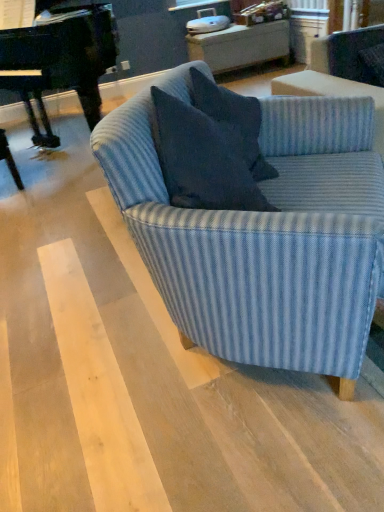
You are a GUI agent. You are given a task and a screenshot of the screen. Output one action in this format:
    pyautogui.click(x=<x>, y=<y>)
    Task: Click on the dark blue fabric pillow at center
    Image resolution: width=384 pixels, height=512 pixels.
    Given the screenshot: What is the action you would take?
    pyautogui.click(x=234, y=121)

What is the approximate height of black polished piano at left?

black polished piano at left is 3.76 feet in height.

Locate an element on the screen. Image resolution: width=384 pixels, height=512 pixels. blue striped fabric couch at center is located at coordinates (265, 237).

Does blue striped fabric swivel chair at upper right have a greater width compared to dark blue fabric pillow at center?

In fact, blue striped fabric swivel chair at upper right might be narrower than dark blue fabric pillow at center.

Between blue striped fabric swivel chair at upper right and dark blue fabric pillow at center, which one has larger size?

dark blue fabric pillow at center.

This screenshot has height=512, width=384. In the image, there is a dark blue fabric pillow at center. What are the coordinates of `swivel chair above it (from the image's perspective)` in the screenshot? It's located at (351, 55).

From the image's perspective, is dark blue fabric pillow at center located beneath blue striped fabric couch at center?

No.

Is dark blue fabric pillow at center oriented towards blue striped fabric couch at center?

Yes, dark blue fabric pillow at center faces towards blue striped fabric couch at center.

Measure the distance from dark blue fabric pillow at center to blue striped fabric couch at center.

They are 11.68 inches apart.

Is dark blue fabric pillow at center surrounding blue striped fabric couch at center?

No, blue striped fabric couch at center is located outside of dark blue fabric pillow at center.

Find the location of a particular element. This screenshot has height=512, width=384. pillow located above the black polished piano at left (from a real-world perspective) is located at coordinates (234, 121).

Considering the points (102, 29) and (242, 129), which point is behind, point (102, 29) or point (242, 129)?

The point (102, 29) is farther from the camera.

From the image's perspective, is black polished piano at left located above or below dark blue fabric pillow at center?

black polished piano at left is above dark blue fabric pillow at center.

Does dark blue fabric pillow at center have a greater height compared to black polished piano at left?

In fact, dark blue fabric pillow at center may be shorter than black polished piano at left.

Does dark blue fabric pillow at center have a greater width compared to black polished piano at left?

In fact, dark blue fabric pillow at center might be narrower than black polished piano at left.

From the image's perspective, is dark blue fabric pillow at center above black polished piano at left?

No.

Based on their sizes in the image, would you say dark blue fabric pillow at center is bigger or smaller than black polished piano at left?

Clearly, dark blue fabric pillow at center is smaller in size than black polished piano at left.

Is dark blue fabric pillow at center far from blue striped fabric swivel chair at upper right?

Indeed, dark blue fabric pillow at center is not near blue striped fabric swivel chair at upper right.

Does dark blue fabric pillow at center appear on the right side of blue striped fabric swivel chair at upper right?

No, dark blue fabric pillow at center is not to the right of blue striped fabric swivel chair at upper right.

From a real-world perspective, is dark blue fabric pillow at center physically above blue striped fabric swivel chair at upper right?

Yes, from a real-world perspective, dark blue fabric pillow at center is above blue striped fabric swivel chair at upper right.

Does point (243, 150) come behind point (313, 61)?

No, (243, 150) is in front of (313, 61).

From the image's perspective, which one is positioned higher, blue striped fabric swivel chair at upper right or blue striped fabric couch at center?

blue striped fabric swivel chair at upper right, from the image's perspective.

Would you say blue striped fabric couch at center is part of blue striped fabric swivel chair at upper right's contents?

No, blue striped fabric swivel chair at upper right does not contain blue striped fabric couch at center.

Between blue striped fabric couch at center and blue striped fabric swivel chair at upper right, which one has less height?

With less height is blue striped fabric swivel chair at upper right.

Considering the sizes of objects blue striped fabric couch at center and blue striped fabric swivel chair at upper right in the image provided, who is bigger, blue striped fabric couch at center or blue striped fabric swivel chair at upper right?

Bigger between the two is blue striped fabric couch at center.

Which of these two, blue striped fabric couch at center or blue striped fabric swivel chair at upper right, is thinner?

With smaller width is blue striped fabric swivel chair at upper right.

How many degrees apart are the facing directions of blue striped fabric couch at center and blue striped fabric swivel chair at upper right?

The facing directions of blue striped fabric couch at center and blue striped fabric swivel chair at upper right are 51.2 degrees apart.

I want to click on swivel chair above the dark blue fabric pillow at center (from the image's perspective), so click(x=351, y=55).

I want to click on pillow on the left of blue striped fabric couch at center, so click(x=234, y=121).

Considering their positions, is blue striped fabric swivel chair at upper right positioned closer to blue striped fabric couch at center than dark blue fabric pillow at center?

dark blue fabric pillow at center lies closer to blue striped fabric couch at center than the other object.

When comparing their distances from black polished piano at left, does dark blue fabric pillow at center or blue striped fabric couch at center seem further?

blue striped fabric couch at center is further to black polished piano at left.

Considering their positions, is dark blue fabric pillow at center positioned closer to blue striped fabric couch at center than blue striped fabric swivel chair at upper right?

dark blue fabric pillow at center is positioned closer to the anchor blue striped fabric couch at center.

Based on their spatial positions, is dark blue fabric pillow at center or blue striped fabric couch at center closer to blue striped fabric swivel chair at upper right?

The object closer to blue striped fabric swivel chair at upper right is dark blue fabric pillow at center.

Looking at the image, which one is located closer to black polished piano at left, blue striped fabric couch at center or dark blue fabric pillow at center?

dark blue fabric pillow at center is closer to black polished piano at left.

From the image, which object appears to be farther from blue striped fabric swivel chair at upper right, dark blue fabric pillow at center or black polished piano at left?

Among the two, black polished piano at left is located further to blue striped fabric swivel chair at upper right.

Based on their spatial positions, is blue striped fabric couch at center or blue striped fabric swivel chair at upper right further from dark blue fabric pillow at center?

blue striped fabric swivel chair at upper right lies further to dark blue fabric pillow at center than the other object.

From the image, which object appears to be farther from blue striped fabric couch at center, black polished piano at left or dark blue fabric pillow at center?

black polished piano at left lies further to blue striped fabric couch at center than the other object.

The height and width of the screenshot is (512, 384). I want to click on pillow between blue striped fabric couch at center and blue striped fabric swivel chair at upper right from front to back, so coord(234,121).

Identify the location of pillow between black polished piano at left and blue striped fabric swivel chair at upper right in the horizontal direction. This screenshot has height=512, width=384. (234, 121).

Where is `studio couch situated between black polished piano at left and blue striped fabric swivel chair at upper right from left to right`? studio couch situated between black polished piano at left and blue striped fabric swivel chair at upper right from left to right is located at coordinates (265, 237).

Image resolution: width=384 pixels, height=512 pixels. Identify the location of pillow between blue striped fabric couch at center and black polished piano at left from front to back. (234, 121).